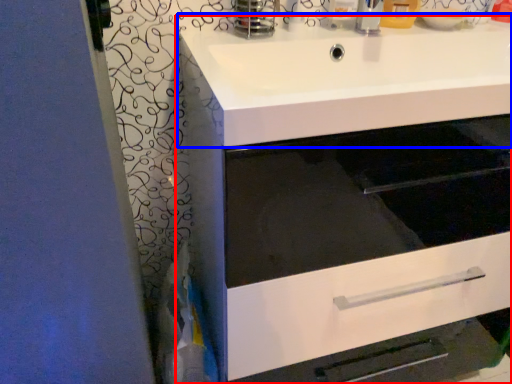
Question: Which object is further to the camera taking this photo, bathroom cabinet (highlighted by a red box) or sink (highlighted by a blue box)?

Choices:
 (A) bathroom cabinet
 (B) sink

Answer: (A)